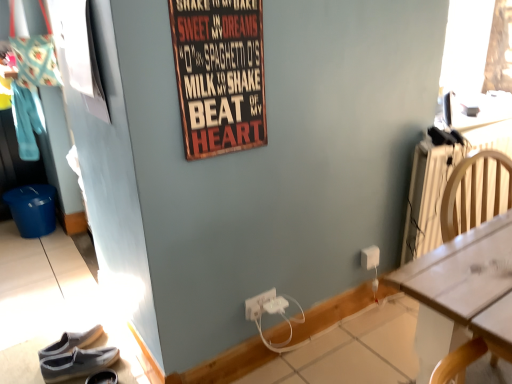
Where is `blue plastic bucket at lower left`? This screenshot has height=384, width=512. blue plastic bucket at lower left is located at coordinates (33, 209).

The width and height of the screenshot is (512, 384). In order to click on dark gray canvas shoes at lower left, acting as the 2th footwear starting from the right in this screenshot , I will do `click(77, 363)`.

Locate an element on the screen. gray fabric shoe at lower left, the 2th footwear in the left-to-right sequence is located at coordinates (103, 377).

Identify the location of white wood desk at right. This screenshot has height=384, width=512. (461, 291).

Find the location of a particular element. wooden signboard at upper center is located at coordinates (219, 74).

Describe the element at coordinates (370, 257) in the screenshot. I see `white plastic power outlet at lower right, the 1th power outlet in the right-to-left sequence` at that location.

Image resolution: width=512 pixels, height=384 pixels. I want to click on blue plastic bucket at lower left, so click(x=33, y=209).

Considering the sizes of dark gray canvas shoes at lower left, the 1th footwear from the left, and white plastic power outlet at lower right, the third power outlet positioned from the front, in the image, is dark gray canvas shoes at lower left, the 1th footwear from the left, bigger or smaller than white plastic power outlet at lower right, the third power outlet positioned from the front,?

Clearly, dark gray canvas shoes at lower left, the 1th footwear from the left, is larger in size than white plastic power outlet at lower right, the third power outlet positioned from the front.

From the image's perspective, is dark gray canvas shoes at lower left, the 1th footwear from the left, below white plastic power outlet at lower right, the third power outlet positioned from the front?

Yes, from the image's perspective, dark gray canvas shoes at lower left, the 1th footwear from the left, is beneath white plastic power outlet at lower right, the third power outlet positioned from the front.

Considering the sizes of objects dark gray canvas shoes at lower left, the 1th footwear from the left, and white plastic power outlet at lower right, acting as the first power outlet starting from the back, in the image provided, who is thinner, dark gray canvas shoes at lower left, the 1th footwear from the left, or white plastic power outlet at lower right, acting as the first power outlet starting from the back,?

white plastic power outlet at lower right, acting as the first power outlet starting from the back, is thinner.

Which of these two, white plastic power outlet at lower right, acting as the first power outlet starting from the back, or white plastic power outlet at lower center, the first power outlet viewed from the left, stands taller?

white plastic power outlet at lower right, acting as the first power outlet starting from the back, is taller.

Based on the photo, considering the sizes of objects white plastic power outlet at lower right, marked as the third power outlet in a left-to-right arrangement, and white plastic power outlet at lower center, placed as the second power outlet when sorted from front to back, in the image provided, who is bigger, white plastic power outlet at lower right, marked as the third power outlet in a left-to-right arrangement, or white plastic power outlet at lower center, placed as the second power outlet when sorted from front to back,?

white plastic power outlet at lower right, marked as the third power outlet in a left-to-right arrangement, is bigger.

Is white plastic power outlet at lower right, the 1th power outlet in the right-to-left sequence, spatially inside white plastic power outlet at lower center, placed as the second power outlet when sorted from front to back, or outside of it?

The correct answer is: outside.

Is gray fabric shoe at lower left, the first footwear viewed from the right, inside dark gray canvas shoes at lower left, acting as the 2th footwear starting from the right?

No, gray fabric shoe at lower left, the first footwear viewed from the right, is not a part of dark gray canvas shoes at lower left, acting as the 2th footwear starting from the right.

Find the location of a particular element. This screenshot has width=512, height=384. footwear below the dark gray canvas shoes at lower left, acting as the 2th footwear starting from the right (from the image's perspective) is located at coordinates (103, 377).

From a real-world perspective, is dark gray canvas shoes at lower left, acting as the 2th footwear starting from the right, located beneath gray fabric shoe at lower left, the 2th footwear in the left-to-right sequence?

Actually, dark gray canvas shoes at lower left, acting as the 2th footwear starting from the right, is physically above gray fabric shoe at lower left, the 2th footwear in the left-to-right sequence, in the real world.

How distant is dark gray canvas shoes at lower left, the 1th footwear from the left, from gray fabric shoe at lower left, the first footwear viewed from the right?

They are 3.45 inches apart.

Considering the points (14, 218) and (100, 356), which point is in front, point (14, 218) or point (100, 356)?

The point (100, 356) is closer.

Between blue plastic bucket at lower left and dark gray canvas shoes at lower left, acting as the 2th footwear starting from the right, which one is positioned in front?

dark gray canvas shoes at lower left, acting as the 2th footwear starting from the right, is more forward.

Which of these two, blue plastic bucket at lower left or dark gray canvas shoes at lower left, the 1th footwear from the left, is bigger?

Bigger between the two is blue plastic bucket at lower left.

Is blue plastic bucket at lower left oriented towards dark gray canvas shoes at lower left, the 1th footwear from the left?

No, blue plastic bucket at lower left does not turn towards dark gray canvas shoes at lower left, the 1th footwear from the left.

Is gray fabric shoe at lower left, the 2th footwear in the left-to-right sequence, wider than white plastic power outlet at lower center, positioned as the second power outlet in left-to-right order?

Correct, the width of gray fabric shoe at lower left, the 2th footwear in the left-to-right sequence, exceeds that of white plastic power outlet at lower center, positioned as the second power outlet in left-to-right order.

Consider the image. How many degrees apart are the facing directions of gray fabric shoe at lower left, the 2th footwear in the left-to-right sequence, and white plastic power outlet at lower center, positioned as the second power outlet in left-to-right order?

They differ by 12.7 degrees in their facing directions.

Looking at this image, would you say gray fabric shoe at lower left, the first footwear viewed from the right, is a long distance from white plastic power outlet at lower center, which is the 2th power outlet in right-to-left order?

That's not correct — gray fabric shoe at lower left, the first footwear viewed from the right, is a little close to white plastic power outlet at lower center, which is the 2th power outlet in right-to-left order.

Starting from the white plastic power outlet at lower center, the 3th power outlet viewed from the right, which power outlet is the 1st one to the right? Please provide its 2D coordinates.

[(276, 305)]

Measure the distance from white plastic power outlet at lower center, placed as the second power outlet when sorted from front to back, to white plastic power outlet at lower center, positioned as the second power outlet in left-to-right order.

The distance of white plastic power outlet at lower center, placed as the second power outlet when sorted from front to back, from white plastic power outlet at lower center, positioned as the second power outlet in left-to-right order, is 4.85 centimeters.

Which of these two, white plastic power outlet at lower center, placed as the second power outlet when sorted from front to back, or white plastic power outlet at lower center, the third power outlet in the back-to-front sequence, is wider?

Wider between the two is white plastic power outlet at lower center, the third power outlet in the back-to-front sequence.

Considering the relative sizes of white plastic power outlet at lower center, the first power outlet viewed from the left, and white plastic power outlet at lower center, the third power outlet in the back-to-front sequence, in the image provided, is white plastic power outlet at lower center, the first power outlet viewed from the left, shorter than white plastic power outlet at lower center, the third power outlet in the back-to-front sequence,?

In fact, white plastic power outlet at lower center, the first power outlet viewed from the left, may be taller than white plastic power outlet at lower center, the third power outlet in the back-to-front sequence.

In the scene shown: Is white plastic power outlet at lower right, acting as the first power outlet starting from the back, oriented away from blue plastic bucket at lower left?

No.

Considering the relative sizes of white plastic power outlet at lower right, the 1th power outlet in the right-to-left sequence, and blue plastic bucket at lower left in the image provided, is white plastic power outlet at lower right, the 1th power outlet in the right-to-left sequence, thinner than blue plastic bucket at lower left?

Correct, the width of white plastic power outlet at lower right, the 1th power outlet in the right-to-left sequence, is less than that of blue plastic bucket at lower left.

Are white plastic power outlet at lower right, acting as the first power outlet starting from the back, and blue plastic bucket at lower left far apart?

white plastic power outlet at lower right, acting as the first power outlet starting from the back, is far away from blue plastic bucket at lower left.

You are a GUI agent. You are given a task and a screenshot of the screen. Output one action in this format:
    pyautogui.click(x=<x>, y=<y>)
    Task: Click on the 1st footwear in front of the white plastic power outlet at lower right, acting as the first power outlet starting from the back
    
    Given the screenshot: What is the action you would take?
    pyautogui.click(x=77, y=363)

From the white plastic power outlet at lower center, placed as the second power outlet when sorted from front to back, count 2nd power outlet to the right and point to it. Please provide its 2D coordinates.

[(370, 257)]

Estimate the real-world distances between objects in this image. Which object is further from wooden signboard at upper center, white plastic power outlet at lower center, positioned as the second power outlet in left-to-right order, or white plastic power outlet at lower center, arranged as the 2th power outlet when viewed from the back?

white plastic power outlet at lower center, positioned as the second power outlet in left-to-right order.

From the image, which object appears to be nearer to white plastic power outlet at lower center, the third power outlet in the back-to-front sequence, white plastic power outlet at lower right, the 1th power outlet in the right-to-left sequence, or wooden signboard at upper center?

Among the two, white plastic power outlet at lower right, the 1th power outlet in the right-to-left sequence, is located nearer to white plastic power outlet at lower center, the third power outlet in the back-to-front sequence.

From the picture: Looking at the image, which one is located further to white plastic power outlet at lower right, the third power outlet positioned from the front, dark gray canvas shoes at lower left, acting as the 2th footwear starting from the right, or white plastic power outlet at lower center, arranged as the 2th power outlet when viewed from the back?

dark gray canvas shoes at lower left, acting as the 2th footwear starting from the right.

Looking at the image, which one is located further to white plastic power outlet at lower right, marked as the third power outlet in a left-to-right arrangement, white wood desk at right or blue plastic bucket at lower left?

Among the two, blue plastic bucket at lower left is located further to white plastic power outlet at lower right, marked as the third power outlet in a left-to-right arrangement.

Looking at the image, which one is located closer to white plastic power outlet at lower center, the first power outlet when ordered from front to back, dark gray canvas shoes at lower left, acting as the 2th footwear starting from the right, or blue plastic bucket at lower left?

dark gray canvas shoes at lower left, acting as the 2th footwear starting from the right, is positioned closer to the anchor white plastic power outlet at lower center, the first power outlet when ordered from front to back.

Which object lies nearer to the anchor point blue plastic bucket at lower left, wooden signboard at upper center or white plastic power outlet at lower right, marked as the third power outlet in a left-to-right arrangement?

wooden signboard at upper center is positioned closer to the anchor blue plastic bucket at lower left.

When comparing their distances from gray fabric shoe at lower left, the 2th footwear in the left-to-right sequence, does white plastic power outlet at lower right, the 1th power outlet in the right-to-left sequence, or white wood desk at right seem closer?

white plastic power outlet at lower right, the 1th power outlet in the right-to-left sequence.

Based on their spatial positions, is gray fabric shoe at lower left, the first footwear viewed from the right, or dark gray canvas shoes at lower left, the 1th footwear from the left, further from white plastic power outlet at lower center, the first power outlet viewed from the left?

dark gray canvas shoes at lower left, the 1th footwear from the left, is further to white plastic power outlet at lower center, the first power outlet viewed from the left.

Find the location of a particular element. footwear between dark gray canvas shoes at lower left, the 1th footwear from the left, and white plastic power outlet at lower right, acting as the first power outlet starting from the back, from left to right is located at coordinates (103, 377).

The height and width of the screenshot is (384, 512). Identify the location of power outlet situated between blue plastic bucket at lower left and white plastic power outlet at lower center, the first power outlet when ordered from front to back, from left to right. (258, 304).

In order to click on footwear between dark gray canvas shoes at lower left, acting as the 2th footwear starting from the right, and white plastic power outlet at lower center, the first power outlet viewed from the left, from left to right in this screenshot , I will do `click(103, 377)`.

Locate an element on the screen. bulletin board between dark gray canvas shoes at lower left, acting as the 2th footwear starting from the right, and white plastic power outlet at lower right, marked as the third power outlet in a left-to-right arrangement, from left to right is located at coordinates (219, 74).